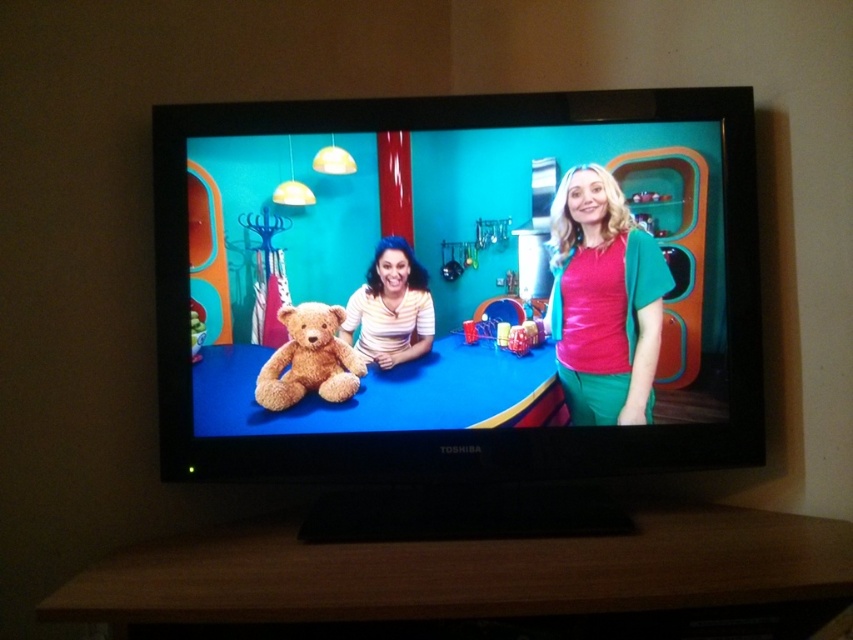
Question: Does matte green skirt at center have a lesser width compared to brown plush teddy bear at center?

Choices:
 (A) no
 (B) yes

Answer: (A)

Question: Which point appears closest to the camera in this image?

Choices:
 (A) (271, 388)
 (B) (369, 314)
 (C) (585, 294)

Answer: (A)

Question: Which object is the closest to the brown plush teddy bear at center?

Choices:
 (A) matte green skirt at center
 (B) brown plush bear at center
 (C) striped fabric shirt at center

Answer: (C)

Question: Can you confirm if brown plush bear at center is positioned to the left of matte green skirt at center?

Choices:
 (A) no
 (B) yes

Answer: (B)

Question: Does brown plush bear at center appear under brown plush teddy bear at center?

Choices:
 (A) no
 (B) yes

Answer: (A)

Question: Considering the real-world distances, which object is closest to the brown plush bear at center?

Choices:
 (A) brown plush teddy bear at center
 (B) matte green skirt at center
 (C) striped fabric shirt at center

Answer: (B)